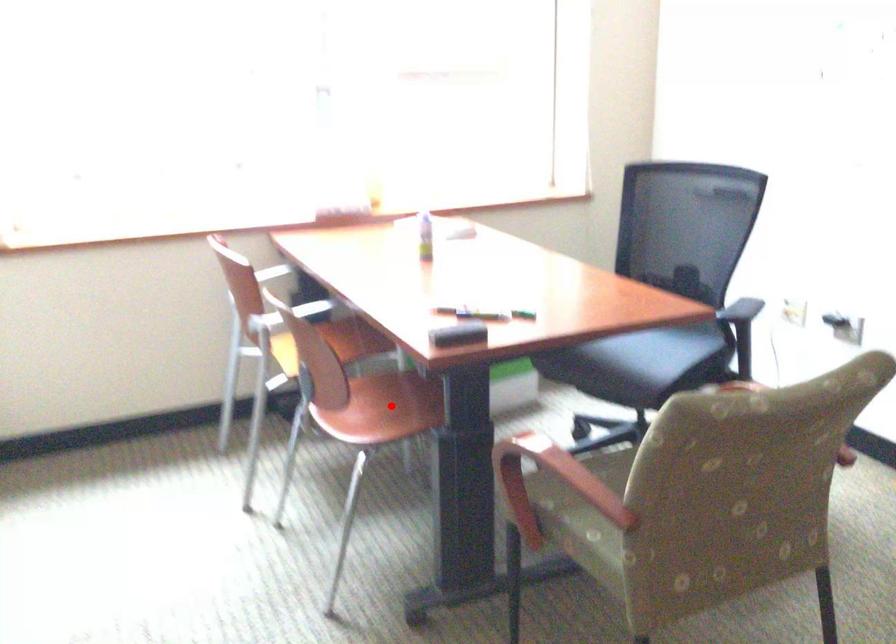
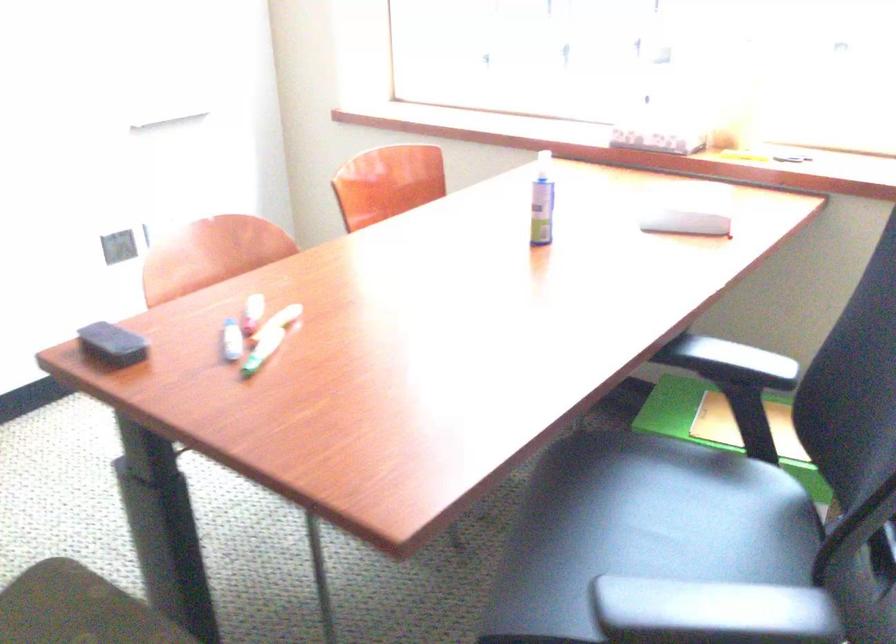
Question: I am providing you with two images of the same scene from different viewpoints. A red point is marked on the first image. Is the red point's position out of view in image 2?

Choices:
 (A) Yes
 (B) No

Answer: (A)